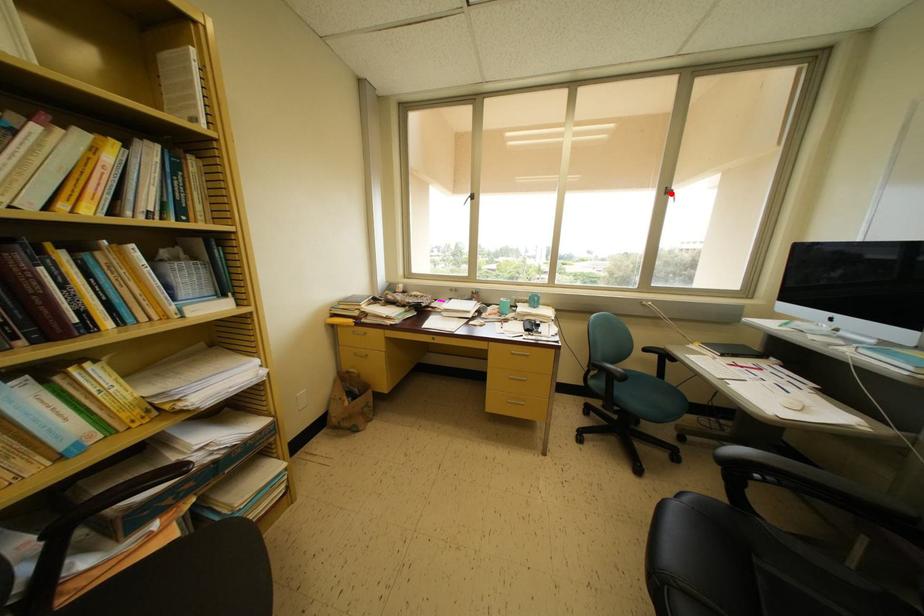
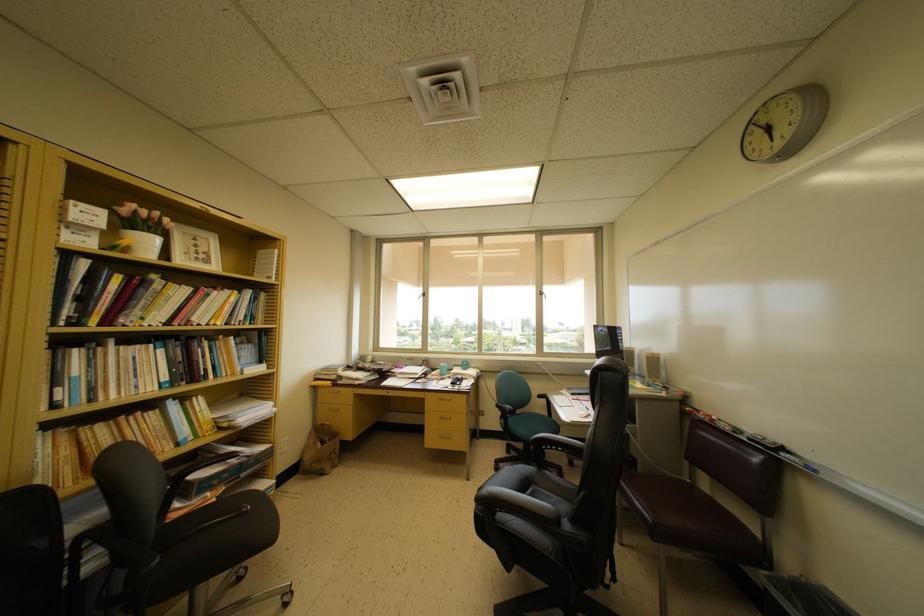
Where in the second image is the point corresponding to the highlighted location from the first image?

(543, 297)